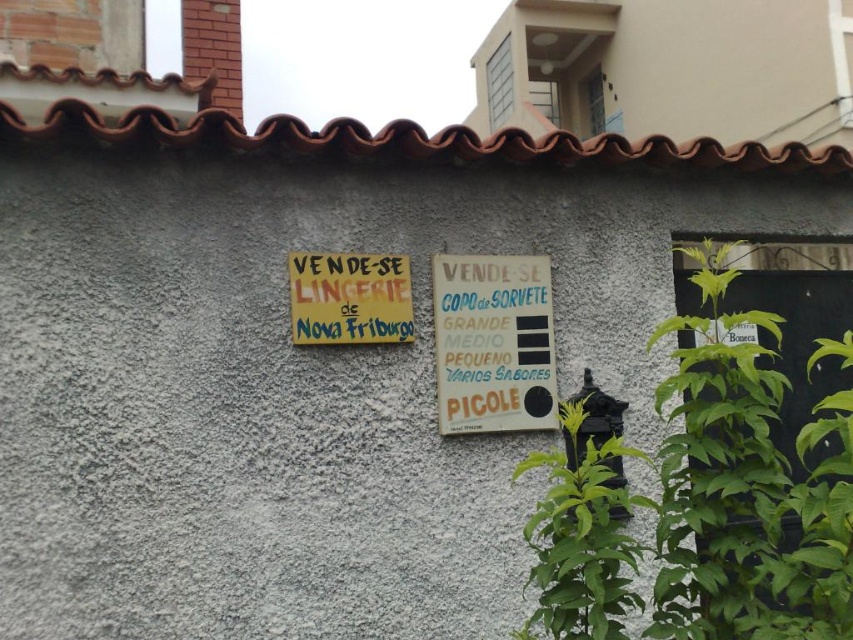
Question: Which point is farther to the camera?

Choices:
 (A) white paper sign at center
 (B) yellow paper sign at upper center

Answer: (A)

Question: Can you confirm if white paper sign at center is smaller than yellow paper sign at upper center?

Choices:
 (A) no
 (B) yes

Answer: (A)

Question: Which object is farther from the camera taking this photo?

Choices:
 (A) yellow paper sign at upper center
 (B) white paper sign at center

Answer: (B)

Question: Does white paper sign at center appear on the right side of yellow paper sign at upper center?

Choices:
 (A) yes
 (B) no

Answer: (A)

Question: Where is white paper sign at center located in relation to yellow paper sign at upper center in the image?

Choices:
 (A) right
 (B) left

Answer: (A)